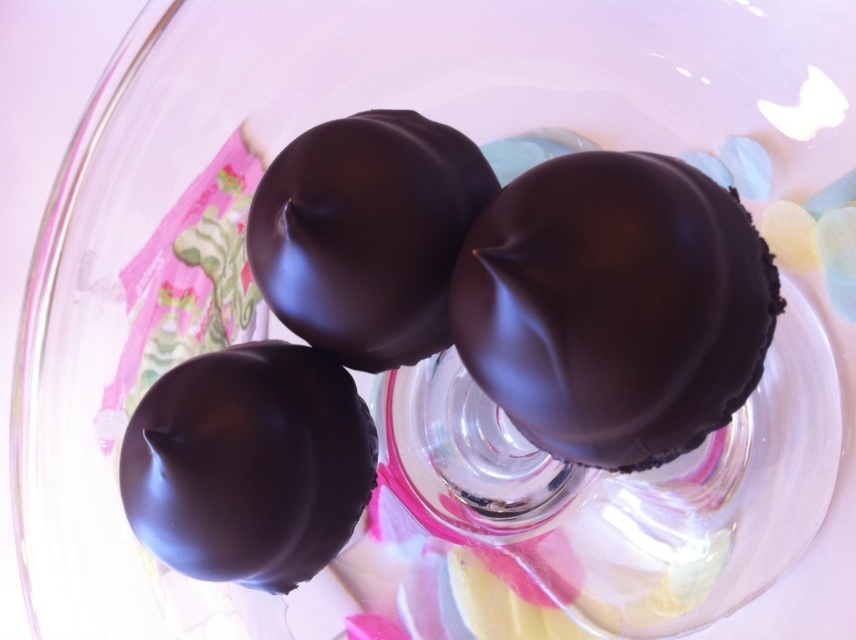
Which of these two, shiny dark chocolate at center or matte dark chocolate at lower left, stands taller?

With more height is shiny dark chocolate at center.

Is point (745, 241) in front of point (201, 577)?

Yes, point (745, 241) is in front of point (201, 577).

Identify the location of shiny dark chocolate at center. The image size is (856, 640). (614, 307).

Is matte dark chocolate at lower left smaller than matte chocolate truffle at center?

Yes, matte dark chocolate at lower left is smaller than matte chocolate truffle at center.

Does matte dark chocolate at lower left have a lesser width compared to matte chocolate truffle at center?

Correct, matte dark chocolate at lower left's width is less than matte chocolate truffle at center's.

Is point (235, 561) in front of point (260, 243)?

No, it is behind (260, 243).

Locate an element on the screen. The height and width of the screenshot is (640, 856). matte dark chocolate at lower left is located at coordinates (248, 465).

Who is taller, shiny dark chocolate at center or matte chocolate truffle at center?

With more height is shiny dark chocolate at center.

Is point (593, 216) behind point (292, 156)?

No, it is not.

The height and width of the screenshot is (640, 856). In order to click on shiny dark chocolate at center in this screenshot , I will do `click(614, 307)`.